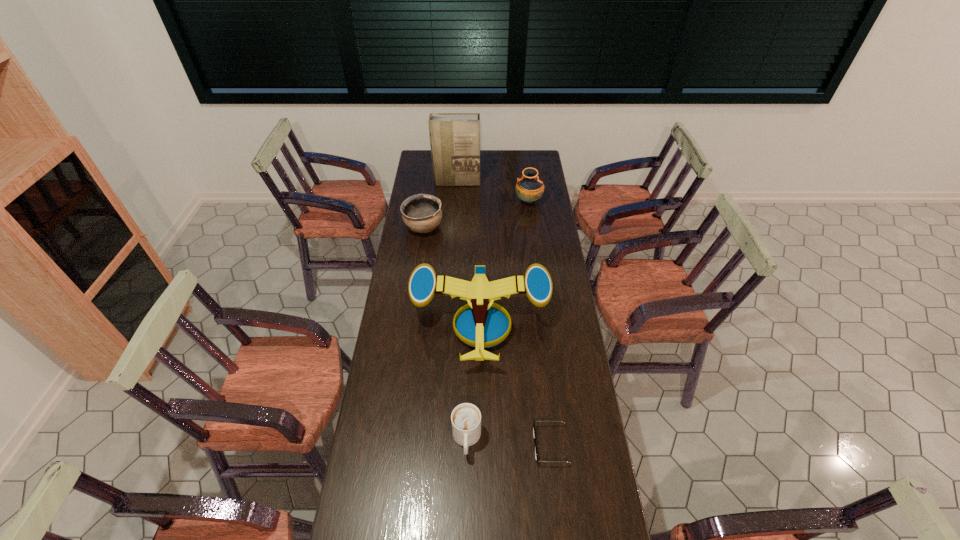
Identify the location of free space located on the front of the right pottery. (532, 230).

Locate an element on the screen. The width and height of the screenshot is (960, 540). free point located 0.200m at the cockpit of the third nearest object is located at coordinates (481, 426).

This screenshot has height=540, width=960. Identify the location of free region located 0.100m on the front of the fourth nearest object. (420, 254).

The width and height of the screenshot is (960, 540). I want to click on vacant area located on the side with the handle of the cappuccino, so click(x=465, y=539).

Find the location of `blank area located on the front-facing side of the shortest object`. blank area located on the front-facing side of the shortest object is located at coordinates (472, 445).

Where is `vacant space located 0.290m on the front-facing side of the shortest object`? This screenshot has height=540, width=960. vacant space located 0.290m on the front-facing side of the shortest object is located at coordinates (444, 445).

Identify the location of vacant space located 0.060m on the front-facing side of the shortest object. Image resolution: width=960 pixels, height=540 pixels. (515, 445).

The height and width of the screenshot is (540, 960). Identify the location of phonebook that is positioned at the left edge. (454, 137).

Find the location of a particular element. This screenshot has width=960, height=540. drone at the left edge is located at coordinates (481, 326).

The width and height of the screenshot is (960, 540). I want to click on pottery at the left edge, so click(421, 213).